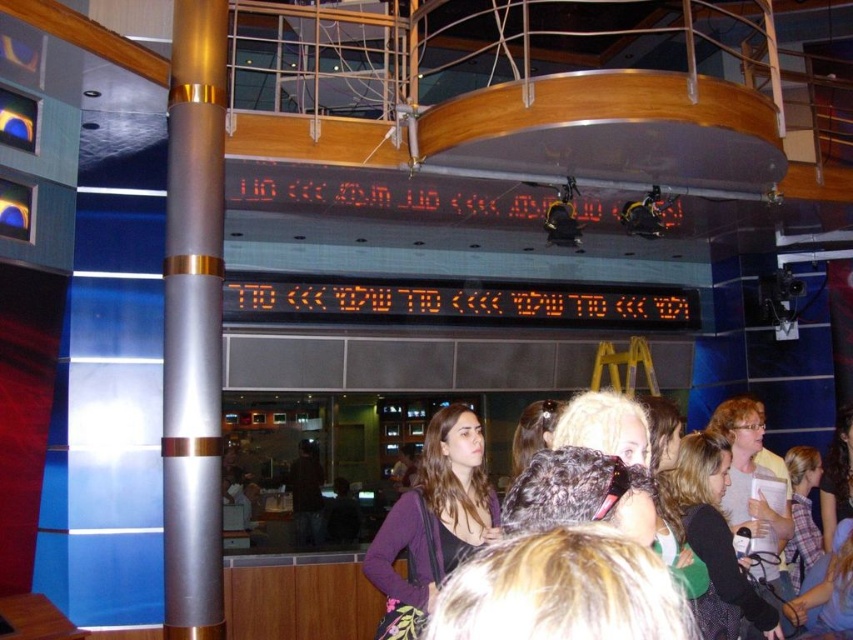
Is silver metallic pole at left wider than black led scoreboard at center?

Incorrect, silver metallic pole at left's width does not surpass black led scoreboard at center's.

Is point (164, 563) positioned before point (526, 310)?

Yes, point (164, 563) is in front of point (526, 310).

Identify the location of silver metallic pole at left. Image resolution: width=853 pixels, height=640 pixels. (193, 323).

Does point (659, 289) lie in front of point (364, 188)?

No, it is behind (364, 188).

Describe the element at coordinates (461, 304) in the screenshot. I see `black led scoreboard at center` at that location.

Is point (541, 298) farther from camera compared to point (260, 205)?

Yes, point (541, 298) is farther from viewer.

Locate an element on the screen. The height and width of the screenshot is (640, 853). black led scoreboard at center is located at coordinates (461, 304).

Between black led scoreboard at center and purple matte/black fabric at center, which one is positioned higher?

Positioned higher is black led scoreboard at center.

Can you confirm if black led scoreboard at center is positioned to the left of purple matte/black fabric at center?

No, black led scoreboard at center is not to the left of purple matte/black fabric at center.

Is point (392, 291) closer to camera compared to point (376, 573)?

No, (392, 291) is behind (376, 573).

Find the location of a particular element. This screenshot has width=853, height=640. black led scoreboard at center is located at coordinates (461, 304).